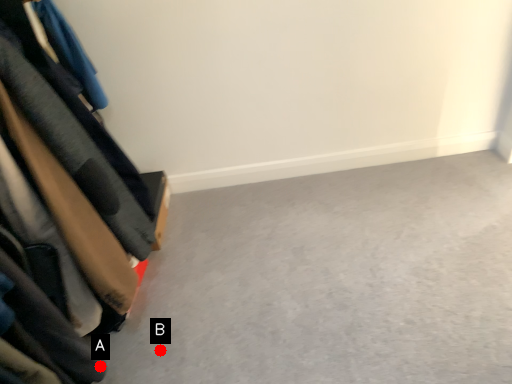
Question: Two points are circled on the image, labeled by A and B beside each circle. Which of the following is the farthest from the observer?

Choices:
 (A) A is further
 (B) B is further

Answer: (B)